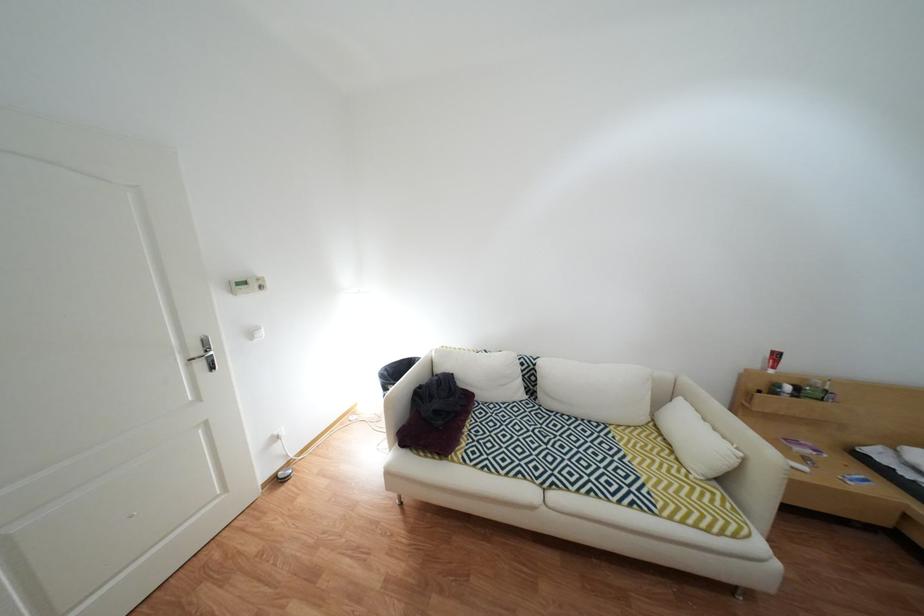
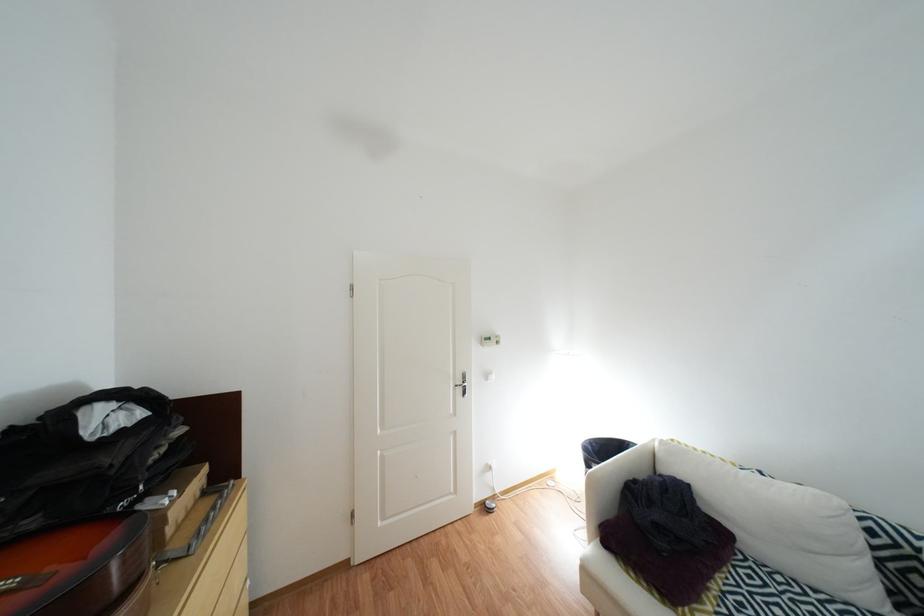
In the second image, find the point that corresponds to point (503, 415) in the first image.

(782, 586)